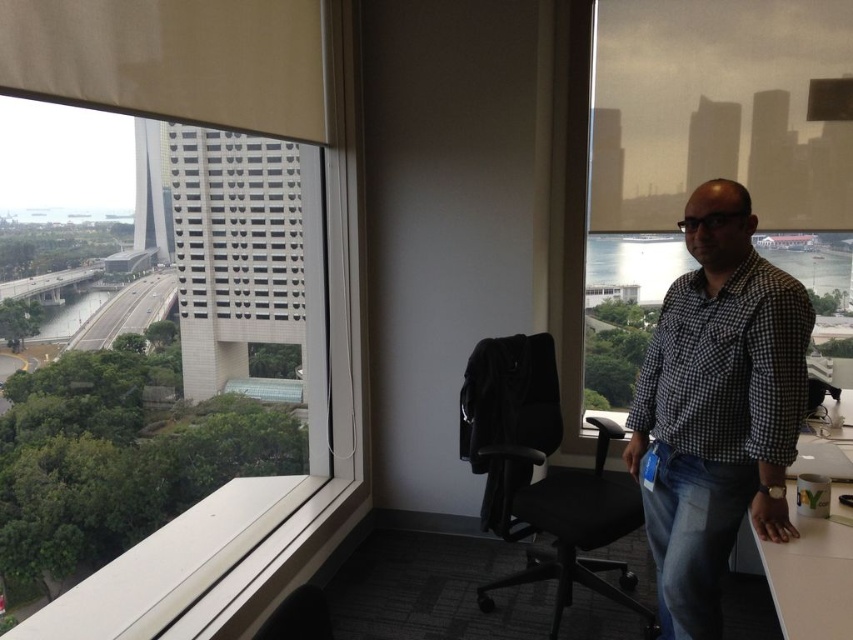
I want to click on checkered fabric shirt at right, so click(717, 406).

Is checkered fabric shirt at right to the right of white matte table at lower right from the viewer's perspective?

In fact, checkered fabric shirt at right is to the left of white matte table at lower right.

Between point (804, 394) and point (822, 636), which one is positioned in front?

Point (822, 636) is in front.

You are a GUI agent. You are given a task and a screenshot of the screen. Output one action in this format:
    pyautogui.click(x=<x>, y=<y>)
    Task: Click on the checkered fabric shirt at right
    
    Given the screenshot: What is the action you would take?
    pyautogui.click(x=717, y=406)

What do you see at coordinates (717, 406) in the screenshot?
I see `checkered fabric shirt at right` at bounding box center [717, 406].

Is checkered fabric shirt at right below black fabric swivel chair at center?

No.

Does point (704, 364) lie behind point (500, 493)?

No, (704, 364) is closer to viewer.

What are the coordinates of `checkered fabric shirt at right` in the screenshot? It's located at (717, 406).

Is transparent glass window at upper left to the left of white matte table at lower right from the viewer's perspective?

Correct, you'll find transparent glass window at upper left to the left of white matte table at lower right.

How distant is transparent glass window at upper left from white matte table at lower right?

transparent glass window at upper left is 5.07 meters from white matte table at lower right.

Locate an element on the screen. transparent glass window at upper left is located at coordinates (328, 273).